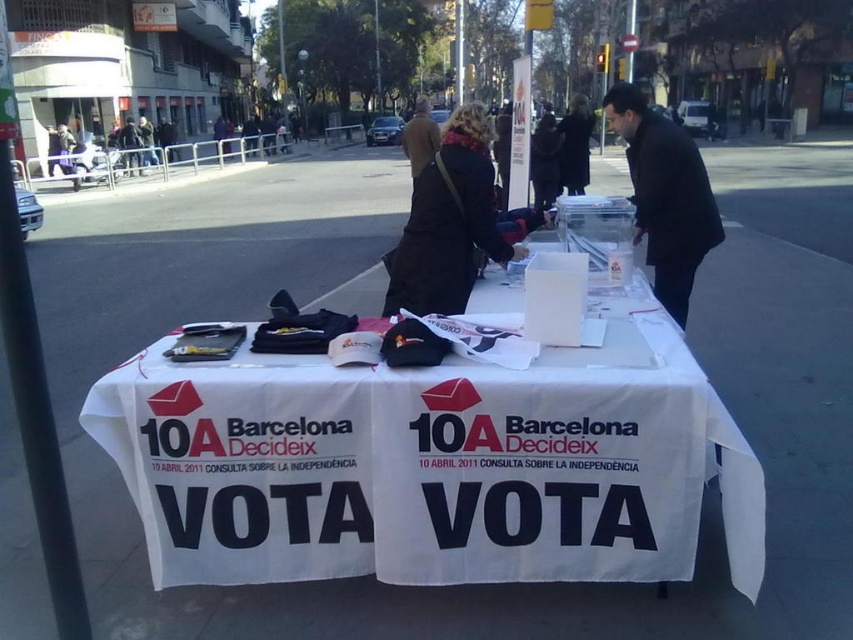
Question: Is black leather jacket at center bigger than black matte coat at center?

Choices:
 (A) yes
 (B) no

Answer: (A)

Question: Among these points, which one is nearest to the camera?

Choices:
 (A) (427, 227)
 (B) (619, 90)

Answer: (A)

Question: In this image, where is black leather jacket at center located relative to black wool coat at center?

Choices:
 (A) below
 (B) above

Answer: (A)

Question: Does black leather jacket at center have a greater width compared to black matte coat at center?

Choices:
 (A) yes
 (B) no

Answer: (A)

Question: Considering the real-world distances, which object is farthest from the black leather jacket at center?

Choices:
 (A) black matte coat at center
 (B) black wool coat at center

Answer: (B)

Question: Among these objects, which one is nearest to the camera?

Choices:
 (A) black leather jacket at center
 (B) black wool coat at center
 (C) black matte coat at center

Answer: (C)